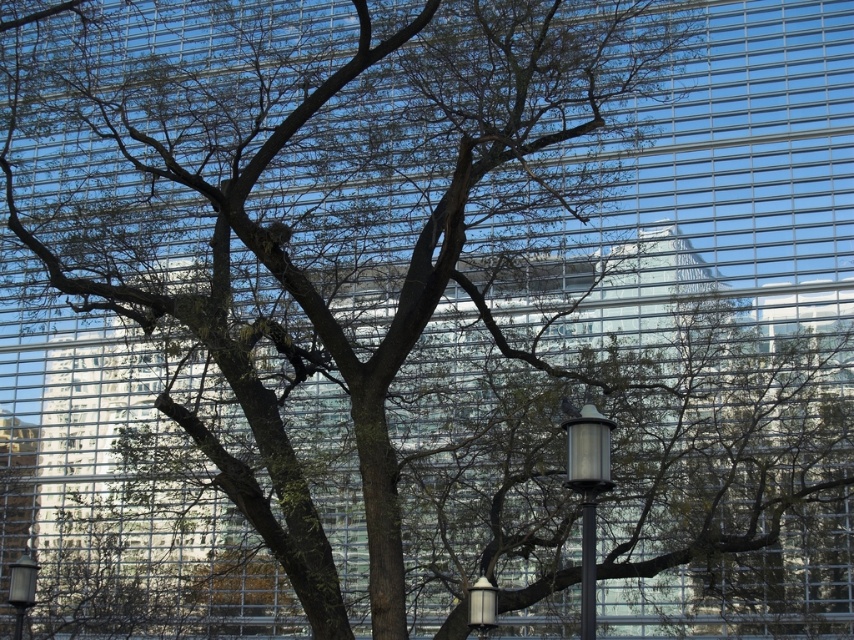
Question: Observing the image, what is the correct spatial positioning of metallic gray lamp post at center in reference to metallic gray lamp post at lower left?

Choices:
 (A) left
 (B) right

Answer: (B)

Question: Is metallic gray lamp post at center positioned behind metallic silver lamp at lower center?

Choices:
 (A) yes
 (B) no

Answer: (B)

Question: Estimate the real-world distances between objects in this image. Which object is farther from the metallic gray lamp post at center?

Choices:
 (A) metallic gray lamp post at lower left
 (B) metallic silver lamp at lower center

Answer: (A)

Question: Based on their relative distances, which object is farther from the metallic gray lamp post at center?

Choices:
 (A) metallic gray lamp post at lower left
 (B) metallic silver lamp at lower center

Answer: (A)

Question: Which of the following is the farthest from the observer?

Choices:
 (A) metallic gray lamp post at center
 (B) metallic gray lamp post at lower left
 (C) metallic silver lamp at lower center

Answer: (B)

Question: Where is metallic gray lamp post at lower left located in relation to metallic silver lamp at lower center in the image?

Choices:
 (A) above
 (B) below

Answer: (B)